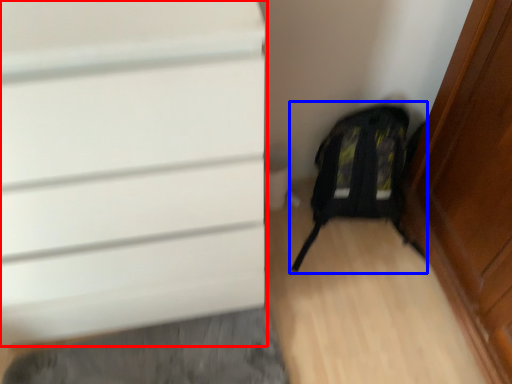
Question: Among these objects, which one is nearest to the camera, door (highlighted by a red box) or backpack (highlighted by a blue box)?

Choices:
 (A) door
 (B) backpack

Answer: (A)